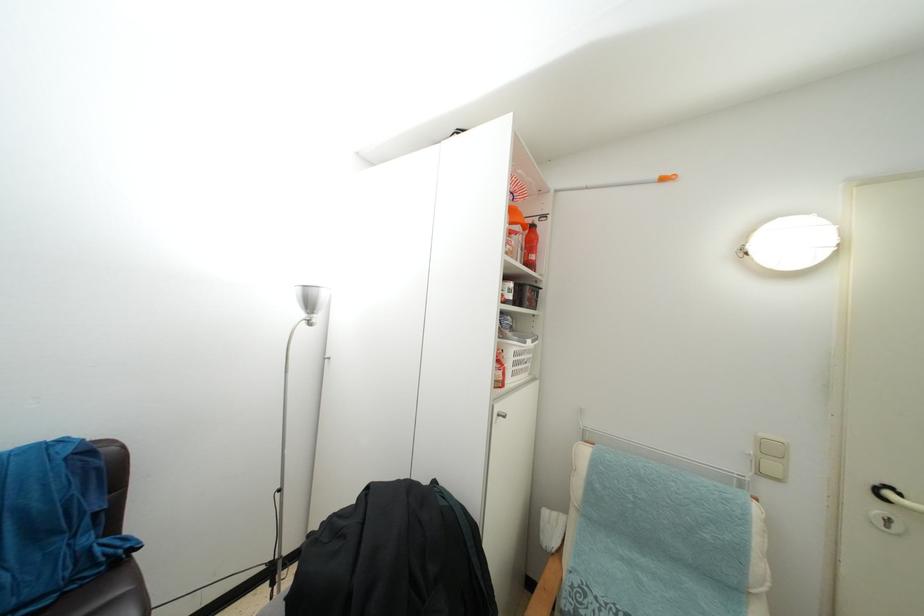
Find where to grasp the orange tool handle. Please return your answer as a coordinate pair (x, y).

(586, 185)